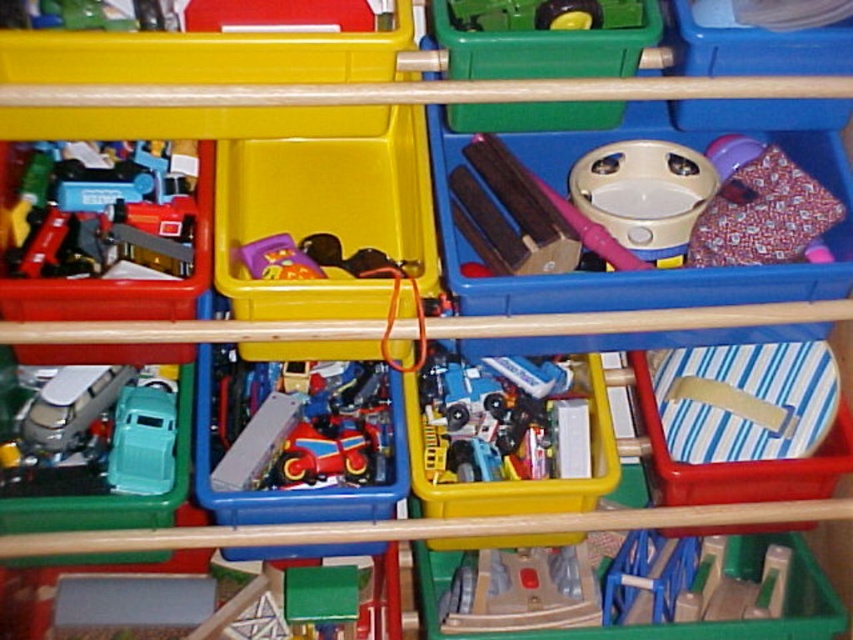
You are organizing a toy shelf and need to place a new toy car. You see both the metallic red car at center and the rubberized plastic toy car at center. Which one is positioned more to the right?

The metallic red car at center is positioned more to the right than the rubberized plastic toy car at center.

You are organizing a child playroom and need to place a new toy car. You see the red fabric bag at upper right and the rubberized plastic toy car at center. Which object is positioned more to the right side of the display?

The red fabric bag at upper right is positioned more to the right side of the display than the rubberized plastic toy car at center.

You are trying to decide which toy to pick up first. The metallic red car at center and the matte silver van at left are both on the same shelf. Which one is taller?

The metallic red car at center is much taller than the matte silver van at left.